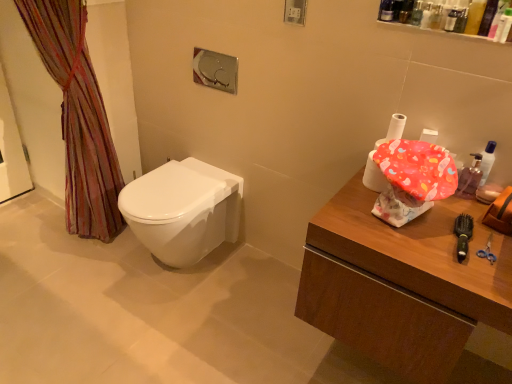
I want to click on free point above white glossy toilet at center (from a real-world perspective), so click(x=170, y=191).